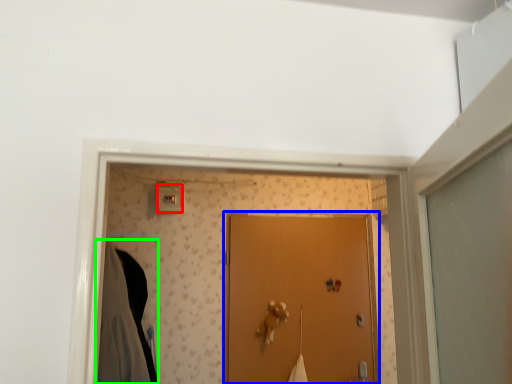
Question: Which object is positioned closest to light switch (highlighted by a red box)? Select from door (highlighted by a blue box) and robe (highlighted by a green box).

Choices:
 (A) door
 (B) robe

Answer: (B)